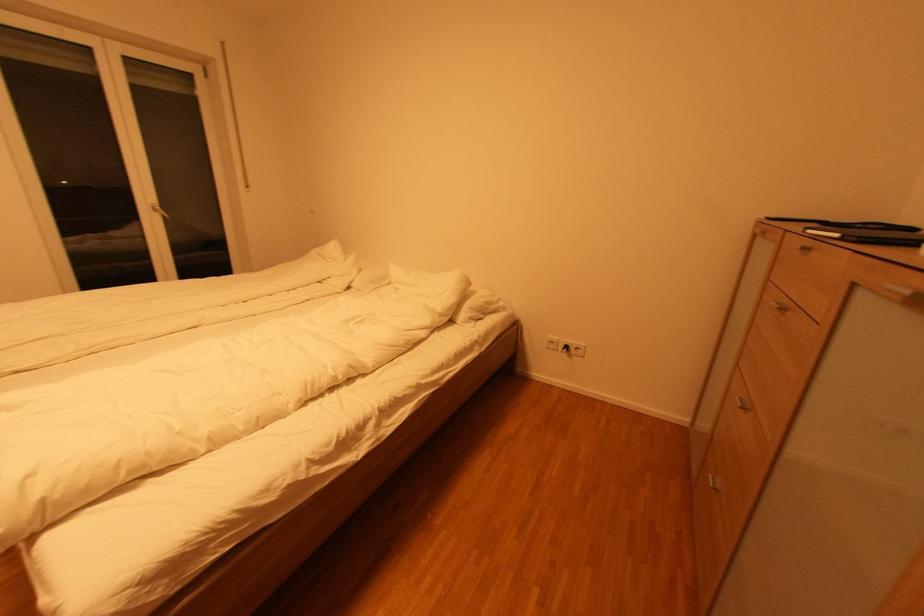
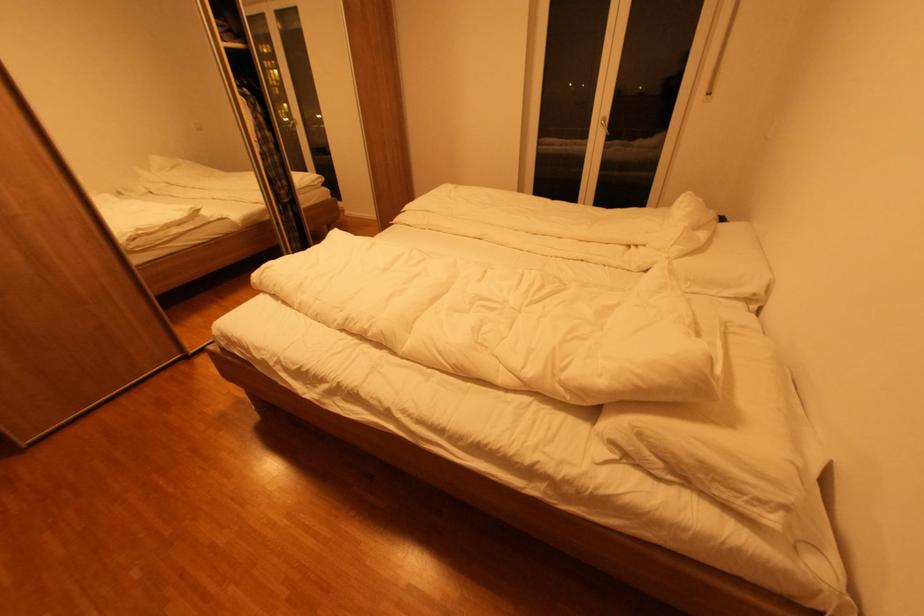
The point at (496, 310) is marked in the first image. Where is the corresponding point in the second image?

(723, 495)